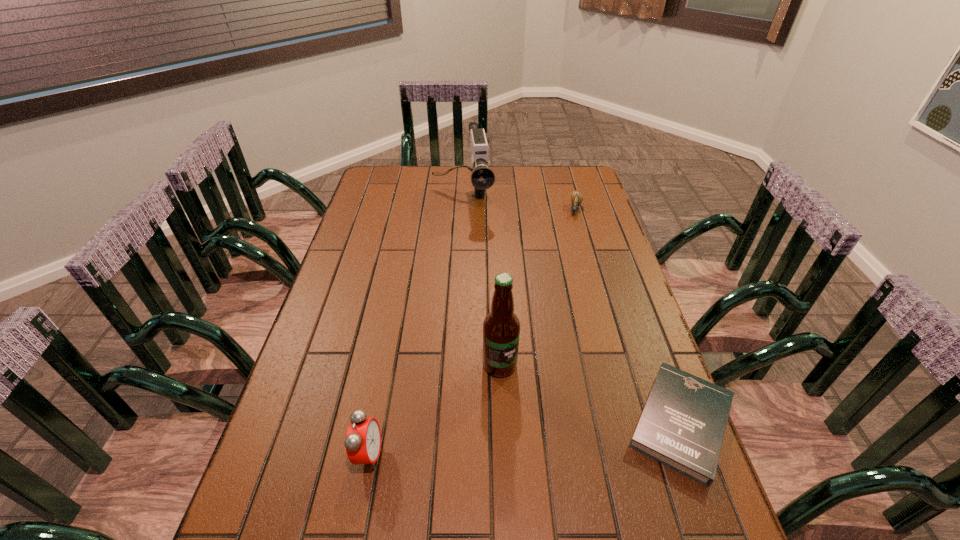
The image size is (960, 540). Identify the location of vacant region located on the recording direction of the second tallest object. (468, 254).

Find the location of a particular element. The width and height of the screenshot is (960, 540). free space located on the label of the tallest object is located at coordinates (568, 511).

Image resolution: width=960 pixels, height=540 pixels. In order to click on vacant area situated 0.060m on the label of the tallest object in this screenshot , I will do `click(516, 398)`.

Identify the location of vacant position located on the label of the tallest object. (544, 460).

Find the location of a particular element. The height and width of the screenshot is (540, 960). free space located on the front-facing side of the fourth tallest object is located at coordinates (572, 236).

This screenshot has width=960, height=540. I want to click on vacant area situated 0.160m on the front-facing side of the fourth tallest object, so click(570, 244).

I want to click on vacant point located on the front-facing side of the fourth tallest object, so click(574, 228).

You are a GUI agent. You are given a task and a screenshot of the screen. Output one action in this format:
    pyautogui.click(x=<x>, y=<y>)
    Task: Click on the object that is at the far edge
    
    Given the screenshot: What is the action you would take?
    pyautogui.click(x=482, y=178)

Where is `object located in the near edge section of the desktop`? The width and height of the screenshot is (960, 540). object located in the near edge section of the desktop is located at coordinates (683, 423).

You are a GUI agent. You are given a task and a screenshot of the screen. Output one action in this format:
    pyautogui.click(x=<x>, y=<y>)
    Task: Click on the book that is at the right edge
    Image resolution: width=960 pixels, height=540 pixels.
    Given the screenshot: What is the action you would take?
    click(683, 423)